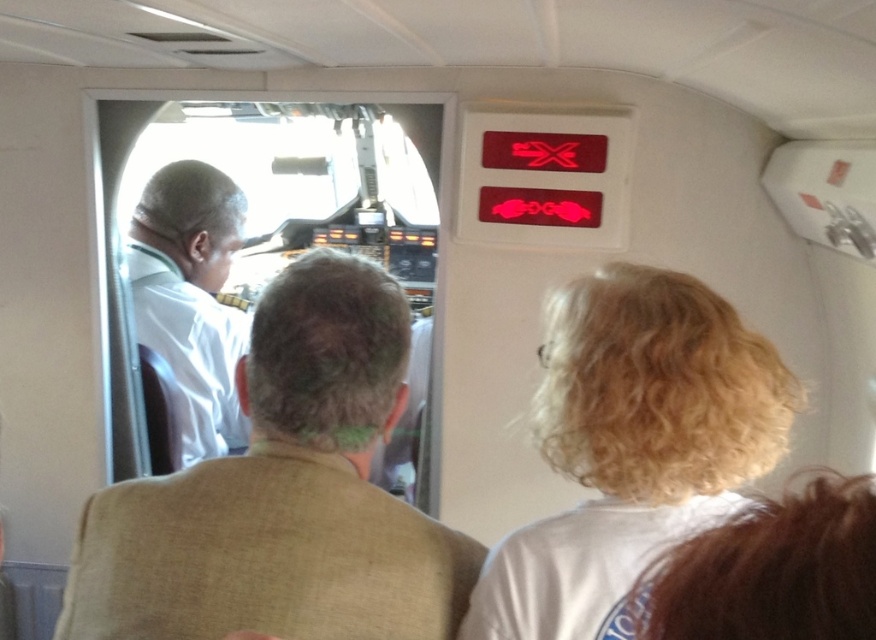
You are a flight attendant standing in the cabin of an aircraft. You need to alert the pilot with white curly hair at upper right and the one with blonde curly hair at upper right about an emergency. Based on their positions, which pilot is seated higher in their seat?

The white curly hair at upper right is taller than blonde curly hair at upper right, so the pilot with white curly hair at upper right is seated higher in their seat.

You are a passenger sitting in the cabin of an aircraft and looking towards the cockpit. You notice two individuals with curly hair at the upper right part of the image. Which of these two, the white curly hair at upper right or the blonde curly hair at upper right, is positioned further to the right?

The white curly hair at upper right is positioned further to the right compared to the blonde curly hair at upper right.

You are standing in the cabin of an aircraft and want to locate two specific points marked on the window. The first point is at coordinate point (x=712, y=580) and the second is at coordinate point (x=217, y=211). Which point is closer to you when looking through the cockpit window?

Point (x=712, y=580) is in front of point (x=217, y=211), so the point closer to you when looking through the cockpit window is point (x=712, y=580).